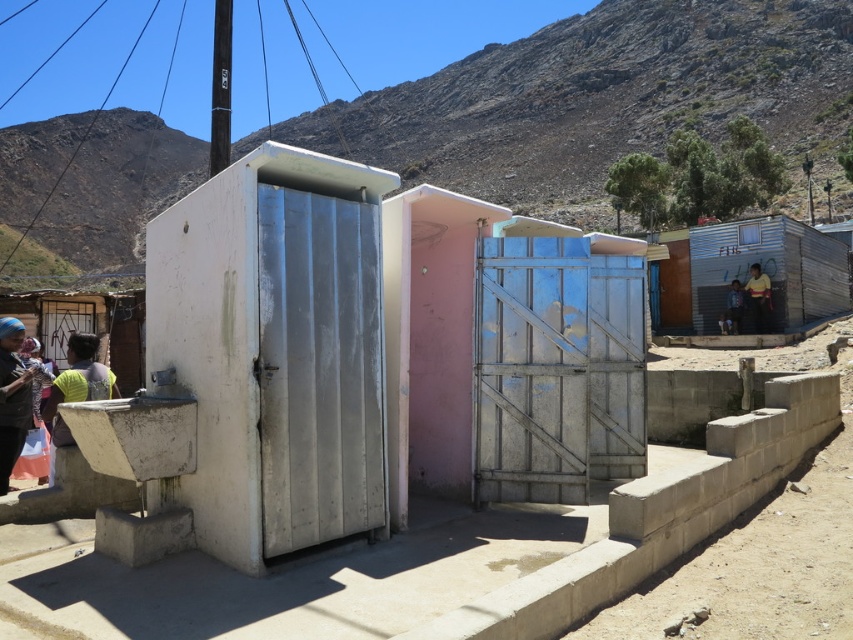
From the picture: Does green fabric shirt at left have a greater width compared to matte blue shirt at lower left?

Yes, green fabric shirt at left is wider than matte blue shirt at lower left.

Who is more forward, (85, 380) or (35, 348)?

Point (85, 380)

Locate an element on the screen. green fabric shirt at left is located at coordinates (76, 388).

Based on the photo, is metallic corrugated hut at center right above blue fabric headscarf at lower left?

Yes, metallic corrugated hut at center right is above blue fabric headscarf at lower left.

Is point (706, 300) positioned before point (4, 404)?

No.

The image size is (853, 640). Find the location of `metallic corrugated hut at center right`. metallic corrugated hut at center right is located at coordinates (747, 273).

Who is higher up, blue fabric headscarf at lower left or yellow shirt at center?

yellow shirt at center is above.

Is blue fabric headscarf at lower left bigger than yellow shirt at center?

Yes, blue fabric headscarf at lower left is bigger than yellow shirt at center.

Does point (16, 346) come closer to viewer compared to point (729, 304)?

Yes, point (16, 346) is in front of point (729, 304).

Find the location of a particular element. The image size is (853, 640). blue fabric headscarf at lower left is located at coordinates (12, 397).